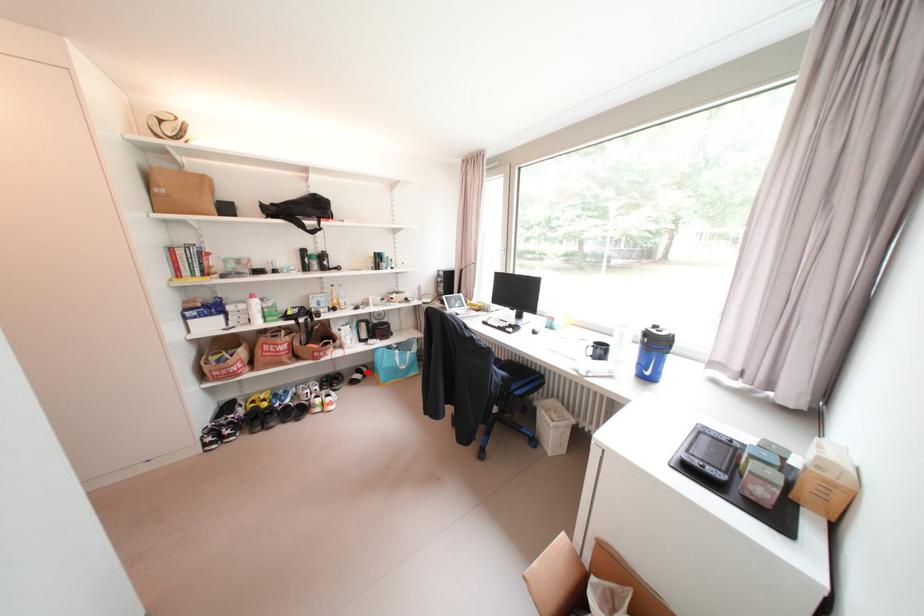
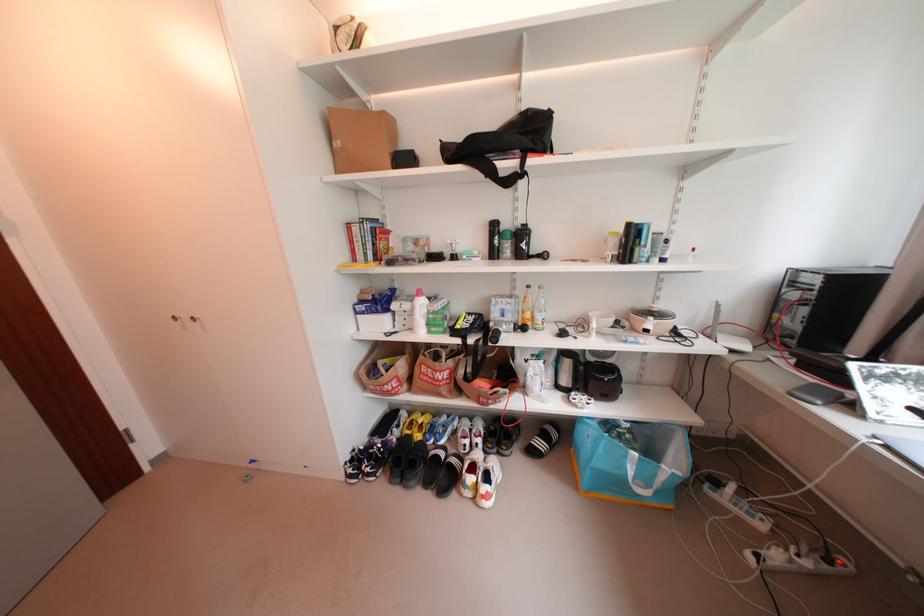
In the second image, find the point that corresponds to the highlighted location in the first image.

(553, 437)